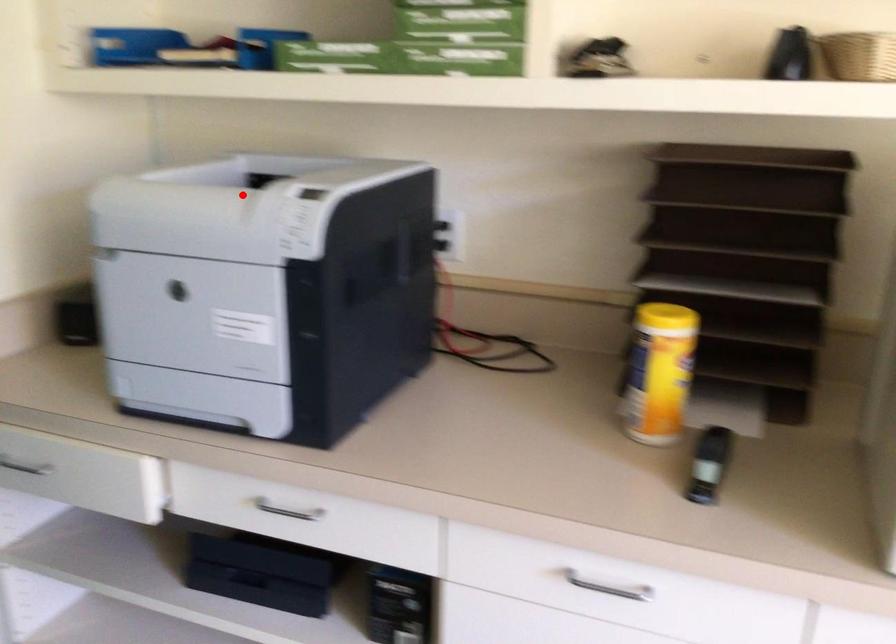
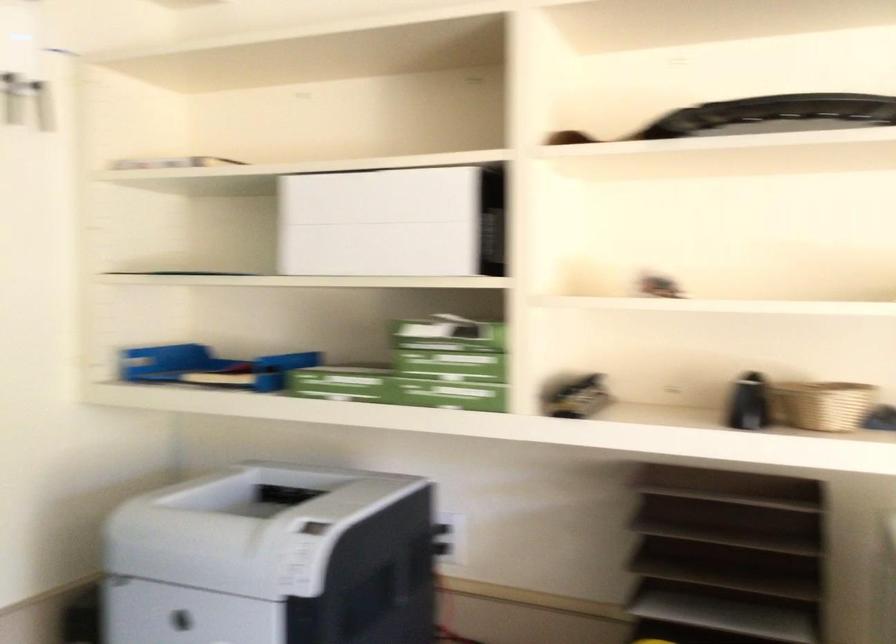
Locate, in the second image, the point that corresponds to the highlighted location in the first image.

(246, 527)